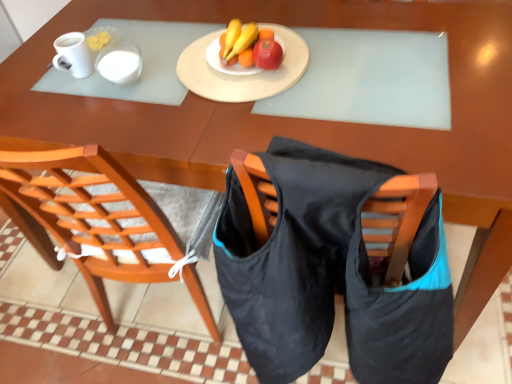
Where is `unoccupied space behind matte yellow banana at center`? The height and width of the screenshot is (384, 512). unoccupied space behind matte yellow banana at center is located at coordinates (240, 20).